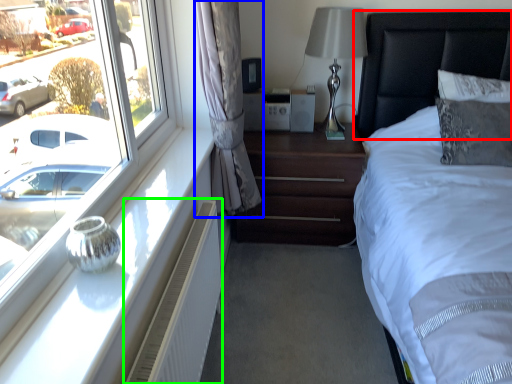
Question: Considering the real-world distances, which object is farthest from headboard (highlighted by a red box)? curtain (highlighted by a blue box) or air conditioner (highlighted by a green box)?

Choices:
 (A) curtain
 (B) air conditioner

Answer: (B)